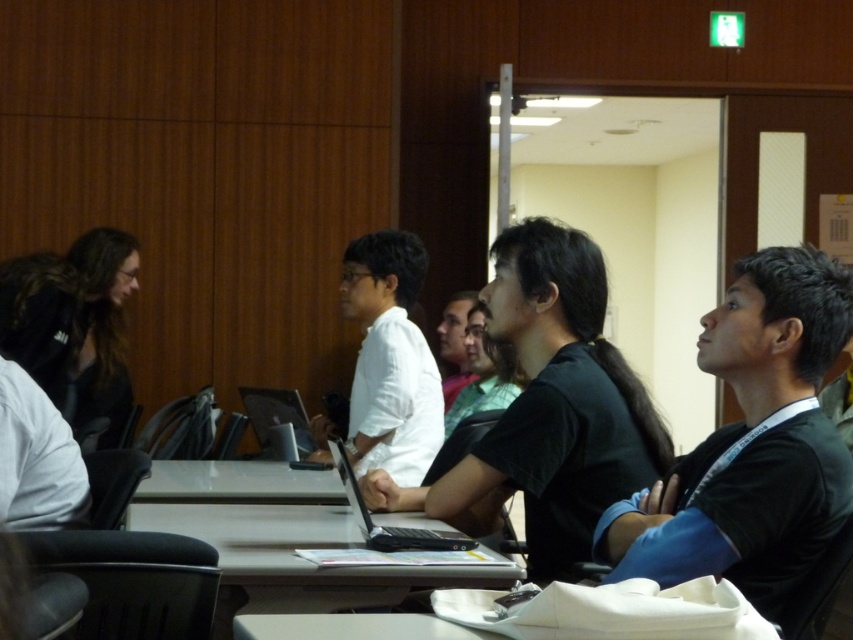
You are standing in the conference room and want to move from point (x=508, y=236) to point (x=432, y=548). Which direction should you face to walk towards the second point?

You should face towards the right and slightly forward because point (x=432, y=548) is located to the right and closer to the camera compared to point (x=508, y=236).